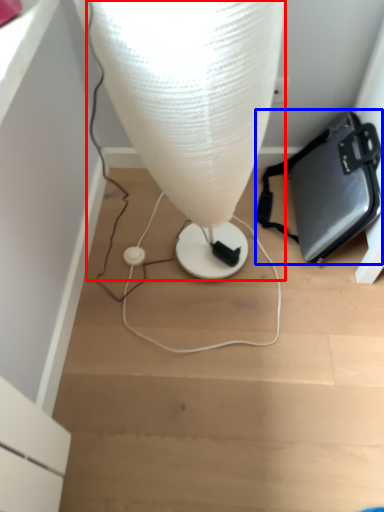
Question: Which object is closer to the camera taking this photo, lamp (highlighted by a red box) or handbag (highlighted by a blue box)?

Choices:
 (A) lamp
 (B) handbag

Answer: (A)